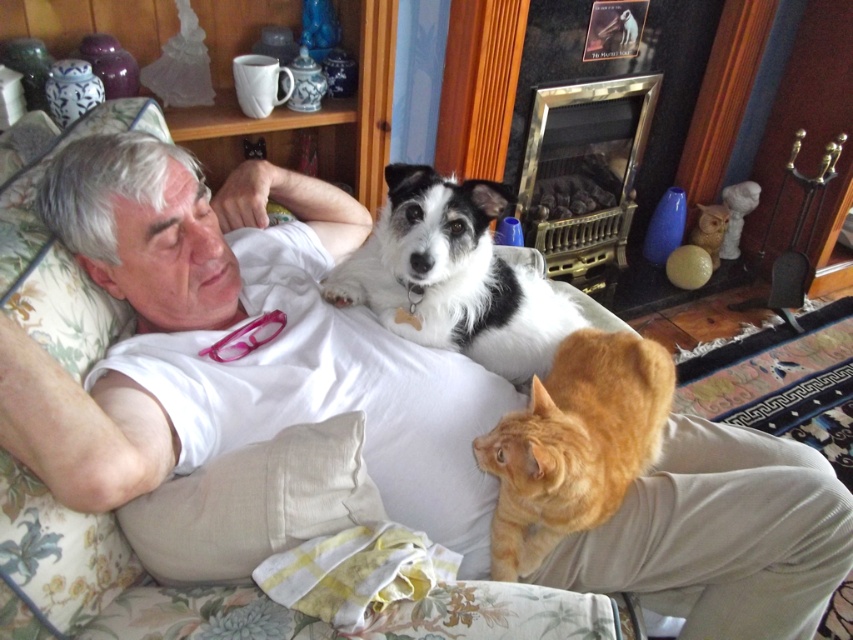
You are a photographer standing in front of the fireplace. You want to take a photo of the orange fur cat at lower right and the gold brass fireplace at center. Which object should you focus on first to ensure both are in focus?

The orange fur cat at lower right is closer to the viewer than the gold brass fireplace at center. To ensure both are in focus, you should focus on the orange fur cat at lower right first, as it is closer, and the depth of field will extend to the fireplace behind it.

You are a photographer standing 5 feet away from the couch. You want to take a closeup photo of the white fluffy dog at upper center. Is the dog within your camera range if the camera can focus up to 4 feet?

The white fluffy dog at upper center is 3.38 feet away from the camera, so yes, it is within the camera range since 3.38 feet is less than 4 feet.

You are a pet sitter who needs to choose a carrier for the white fluffy dog at upper center and the orange fur cat at lower right. The carrier can only fit one pet at a time. Which pet requires a larger carrier?

The white fluffy dog at upper center requires a larger carrier because it is larger in size than the orange fur cat at lower right.